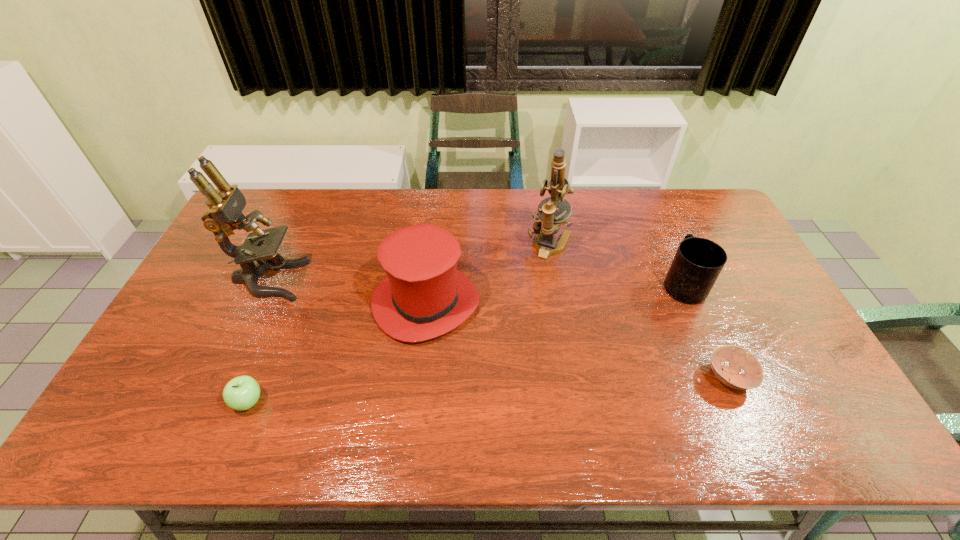
Where is `free point between the left microscope and the apple`? This screenshot has height=540, width=960. free point between the left microscope and the apple is located at coordinates (258, 341).

At what (x,y) coordinates should I click in order to perform the action: click on the fifth closest object to the third shortest object. Please return your answer as a coordinate pair (x, y). The height and width of the screenshot is (540, 960). Looking at the image, I should click on point(241,393).

Where is `object that is the second closest one to the right microscope`? The height and width of the screenshot is (540, 960). object that is the second closest one to the right microscope is located at coordinates (698, 262).

At what (x,y) coordinates should I click in order to perform the action: click on vacant space that satisfies the following two spatial constraints: 1. on the front side of the shortest object; 2. on the left side of the hat. Please return your answer as a coordinate pair (x, y). Looking at the image, I should click on (418, 377).

The height and width of the screenshot is (540, 960). I want to click on vacant point that satisfies the following two spatial constraints: 1. at the eyepieces of the fifth tallest object; 2. on the left side of the left microscope, so click(x=213, y=402).

Identify the location of free point that satisfies the following two spatial constraints: 1. at the eyepieces of the fifth tallest object; 2. on the left side of the left microscope. (213, 402).

Identify the location of vacant point that satisfies the following two spatial constraints: 1. at the eyepieces of the second shortest object; 2. on the right side of the left microscope. (213, 402).

Locate an element on the screen. free location that satisfies the following two spatial constraints: 1. at the eyepieces of the fourth object from right to left; 2. on the right side of the left microscope is located at coordinates (258, 302).